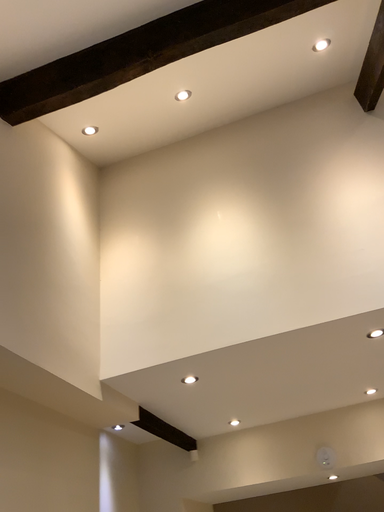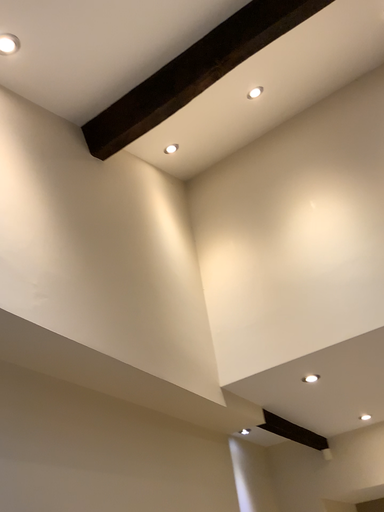
Question: Which way did the camera rotate in the video?

Choices:
 (A) rotated right
 (B) rotated left

Answer: (B)